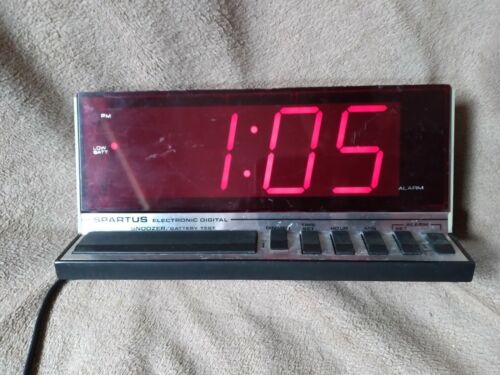
Identify the location of blakc electric cord. (41, 318).